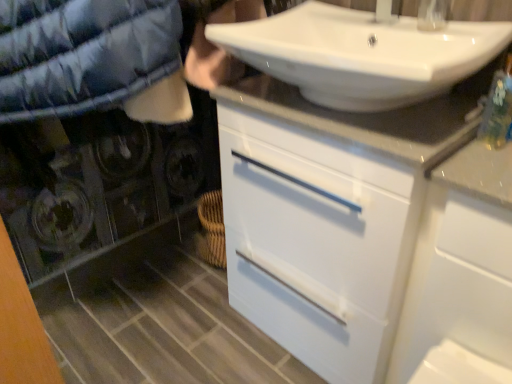
Question: Does white glossy faucet at upper center appear on the left side of white glossy cabinet at center?

Choices:
 (A) no
 (B) yes

Answer: (A)

Question: From a real-world perspective, does white glossy faucet at upper center sit lower than white glossy cabinet at center?

Choices:
 (A) yes
 (B) no

Answer: (B)

Question: Is white glossy faucet at upper center outside white glossy cabinet at center?

Choices:
 (A) no
 (B) yes

Answer: (B)

Question: Does white glossy faucet at upper center have a larger size compared to white glossy cabinet at center?

Choices:
 (A) yes
 (B) no

Answer: (B)

Question: Is white glossy faucet at upper center turned away from white glossy cabinet at center?

Choices:
 (A) yes
 (B) no

Answer: (B)

Question: From a real-world perspective, is white glossy cabinet at upper right physically located above or below white glossy faucet at upper center?

Choices:
 (A) below
 (B) above

Answer: (A)

Question: Based on their positions, is white glossy cabinet at upper right located to the left or right of white glossy faucet at upper center?

Choices:
 (A) right
 (B) left

Answer: (A)

Question: Does point (467, 362) appear closer or farther from the camera than point (419, 23)?

Choices:
 (A) closer
 (B) farther

Answer: (A)

Question: Is white glossy cabinet at upper right inside the boundaries of white glossy faucet at upper center, or outside?

Choices:
 (A) inside
 (B) outside

Answer: (B)

Question: Is white glossy cabinet at center wider or thinner than white glossy cabinet at upper right?

Choices:
 (A) wide
 (B) thin

Answer: (A)

Question: Would you say white glossy cabinet at center is to the left or to the right of white glossy cabinet at upper right in the picture?

Choices:
 (A) right
 (B) left

Answer: (B)

Question: Considering their positions, is white glossy cabinet at center located in front of or behind white glossy cabinet at upper right?

Choices:
 (A) behind
 (B) front

Answer: (A)

Question: Choose the correct answer: Is white glossy cabinet at center inside white glossy cabinet at upper right or outside it?

Choices:
 (A) inside
 (B) outside

Answer: (B)

Question: Which is correct: white glossy faucet at upper center is inside white glossy sink at upper center, or outside of it?

Choices:
 (A) outside
 (B) inside

Answer: (A)

Question: Relative to white glossy sink at upper center, is white glossy faucet at upper center in front or behind?

Choices:
 (A) behind
 (B) front

Answer: (A)